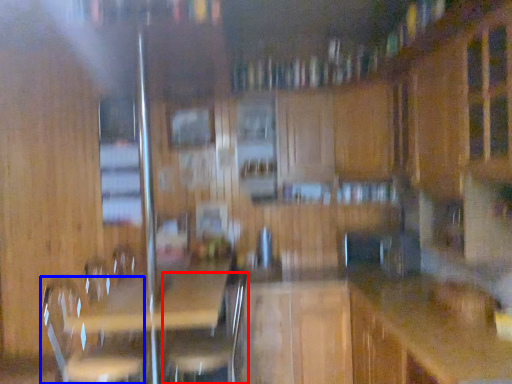
Question: Which of the following is the closest to the observer, swivel chair (highlighted by a red box) or swivel chair (highlighted by a blue box)?

Choices:
 (A) swivel chair
 (B) swivel chair

Answer: (B)